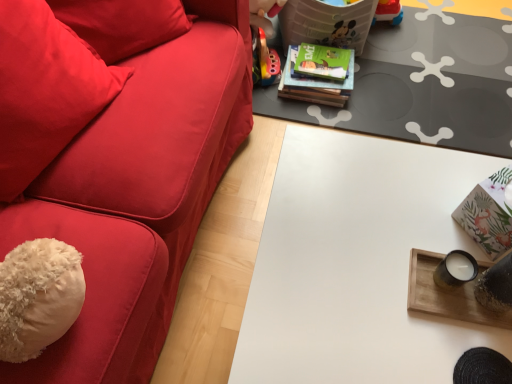
The image size is (512, 384). What do you see at coordinates (447, 294) in the screenshot?
I see `wooden tray at right, positioned as the 2th table in back-to-front order` at bounding box center [447, 294].

The width and height of the screenshot is (512, 384). What do you see at coordinates (45, 90) in the screenshot?
I see `velvety red throw pillow at left` at bounding box center [45, 90].

Where is `velvety red throw pillow at left`? The height and width of the screenshot is (384, 512). velvety red throw pillow at left is located at coordinates (45, 90).

This screenshot has height=384, width=512. What do you see at coordinates (314, 84) in the screenshot?
I see `green matte book at upper center` at bounding box center [314, 84].

At what (x,y) coordinates should I click in order to perform the action: click on matte gray table at center, the third table positioned from the bottom. Please return your answer as a coordinate pair (x, y). Looking at the image, I should click on (423, 85).

Measure the distance between matte gray table at center, the 1th table from the back, and camera.

A distance of 1.47 meters exists between matte gray table at center, the 1th table from the back, and camera.

Locate an element on the screen. This screenshot has width=512, height=384. wooden tray at right, the second table in the bottom-to-top sequence is located at coordinates (447, 294).

Is white matte table at center, the first table when ordered from front to back, touching green matte book at upper center?

No, white matte table at center, the first table when ordered from front to back, is not touching green matte book at upper center.

In terms of width, does white matte table at center, which ranks as the first table in bottom-to-top order, look wider or thinner when compared to green matte book at upper center?

Clearly, white matte table at center, which ranks as the first table in bottom-to-top order, has more width compared to green matte book at upper center.

Considering the relative sizes of white matte table at center, the 3th table when ordered from top to bottom, and green matte book at upper center in the image provided, is white matte table at center, the 3th table when ordered from top to bottom, bigger than green matte book at upper center?

Correct, white matte table at center, the 3th table when ordered from top to bottom, is larger in size than green matte book at upper center.

Do you think white matte table at center, which ranks as the first table in bottom-to-top order, is within green matte book at upper center, or outside of it?

white matte table at center, which ranks as the first table in bottom-to-top order, is located beyond the bounds of green matte book at upper center.

Is white matte table at center, the 3th table when ordered from top to bottom, looking in the opposite direction of velvety red throw pillow at left?

Yes, white matte table at center, the 3th table when ordered from top to bottom, is facing away from velvety red throw pillow at left.

Is white matte table at center, which ranks as the 3th table in back-to-front order, positioned far away from velvety red throw pillow at left?

Actually, white matte table at center, which ranks as the 3th table in back-to-front order, and velvety red throw pillow at left are a little close together.

From their relative heights in the image, would you say white matte table at center, which ranks as the 3th table in back-to-front order, is taller or shorter than velvety red throw pillow at left?

white matte table at center, which ranks as the 3th table in back-to-front order, is taller than velvety red throw pillow at left.

From a real-world perspective, is wooden tray at right, the second table when ordered from front to back, located beneath velvety red throw pillow at left?

Yes.

Is wooden tray at right, the second table in the bottom-to-top sequence, at the right side of velvety red throw pillow at left?

Yes.

From their relative heights in the image, would you say wooden tray at right, the second table when ordered from front to back, is taller or shorter than velvety red throw pillow at left?

In the image, wooden tray at right, the second table when ordered from front to back, appears to be shorter than velvety red throw pillow at left.

Is velvety red throw pillow at left spatially inside green matte book at upper center, or outside of it?

velvety red throw pillow at left is outside green matte book at upper center.

Between velvety red throw pillow at left and green matte book at upper center, which one has larger size?

With larger size is velvety red throw pillow at left.

Is point (50, 18) closer to camera compared to point (334, 89)?

That is True.

Is velvety red throw pillow at left taller or shorter than green matte book at upper center?

velvety red throw pillow at left is taller than green matte book at upper center.

Does wooden tray at right, marked as the 2th table in a top-to-bottom arrangement, appear on the right side of matte gray table at center, which appears as the first table when viewed from the top?

Incorrect, wooden tray at right, marked as the 2th table in a top-to-bottom arrangement, is not on the right side of matte gray table at center, which appears as the first table when viewed from the top.

Is matte gray table at center, which appears as the first table when viewed from the top, at the back of wooden tray at right, the second table in the bottom-to-top sequence?

wooden tray at right, the second table in the bottom-to-top sequence, does not have its back to matte gray table at center, which appears as the first table when viewed from the top.

Looking at this image, can you confirm if wooden tray at right, positioned as the 2th table in back-to-front order, is shorter than matte gray table at center, the 1th table from the back?

Correct, wooden tray at right, positioned as the 2th table in back-to-front order, is not as tall as matte gray table at center, the 1th table from the back.

Is wooden tray at right, marked as the 2th table in a top-to-bottom arrangement, not within matte gray table at center, the third table positioned from the bottom?

Yes, wooden tray at right, marked as the 2th table in a top-to-bottom arrangement, is not within matte gray table at center, the third table positioned from the bottom.

Is matte gray table at center, which appears as the first table when viewed from the top, outside of velvety red throw pillow at left?

Yes, matte gray table at center, which appears as the first table when viewed from the top, is located beyond the bounds of velvety red throw pillow at left.

Is matte gray table at center, the 1th table from the back, positioned behind velvety red throw pillow at left?

Yes, matte gray table at center, the 1th table from the back, is further from the camera.

Considering the relative sizes of matte gray table at center, which appears as the first table when viewed from the top, and velvety red throw pillow at left in the image provided, is matte gray table at center, which appears as the first table when viewed from the top, wider than velvety red throw pillow at left?

Yes, matte gray table at center, which appears as the first table when viewed from the top, is wider than velvety red throw pillow at left.

From a real-world perspective, is matte gray table at center, which appears as the first table when viewed from the top, positioned above or below velvety red throw pillow at left?

matte gray table at center, which appears as the first table when viewed from the top, is below velvety red throw pillow at left.

Is matte gray table at center, which appears as the first table when viewed from the top, located within velvety red throw pillow at left?

Definitely not — matte gray table at center, which appears as the first table when viewed from the top, is not inside velvety red throw pillow at left.

Which of these two, velvety red throw pillow at left or matte gray table at center, which appears as the first table when viewed from the top, is smaller?

Smaller between the two is matte gray table at center, which appears as the first table when viewed from the top.

Is velvety red throw pillow at left shorter than matte gray table at center, which is the 3th table from front to back?

Incorrect, the height of velvety red throw pillow at left does not fall short of that of matte gray table at center, which is the 3th table from front to back.

Is velvety red throw pillow at left aimed at matte gray table at center, which appears as the first table when viewed from the top?

No, velvety red throw pillow at left is not turned towards matte gray table at center, which appears as the first table when viewed from the top.

You are a GUI agent. You are given a task and a screenshot of the screen. Output one action in this format:
    pyautogui.click(x=<x>, y=<y>)
    Task: Click on the magazine lying on the left of white matte table at center, which ranks as the first table in bottom-to-top order
    This screenshot has width=512, height=384.
    Given the screenshot: What is the action you would take?
    pyautogui.click(x=314, y=84)

Find the location of a particular element. Image resolution: width=512 pixels, height=384 pixels. table that is the 1st object to the right of the velvety red throw pillow at left, starting at the anchor is located at coordinates (356, 263).

Looking at the image, which one is located further to green matte book at upper center, matte gray table at center, the third table positioned from the bottom, or white matte table at center, which ranks as the 3th table in back-to-front order?

white matte table at center, which ranks as the 3th table in back-to-front order, lies further to green matte book at upper center than the other object.

From the image, which object appears to be nearer to wooden tray at right, positioned as the 2th table in back-to-front order, velvety red throw pillow at left or white matte table at center, the 3th table when ordered from top to bottom?

white matte table at center, the 3th table when ordered from top to bottom, is closer to wooden tray at right, positioned as the 2th table in back-to-front order.

Looking at the image, which one is located further to green matte book at upper center, white matte table at center, the first table when ordered from front to back, or matte gray table at center, the third table positioned from the bottom?

white matte table at center, the first table when ordered from front to back, is positioned further to the anchor green matte book at upper center.

Which object lies further to the anchor point white matte table at center, which ranks as the 3th table in back-to-front order, green matte book at upper center or velvety red throw pillow at left?

green matte book at upper center.

When comparing their distances from green matte book at upper center, does white matte table at center, which ranks as the 3th table in back-to-front order, or wooden tray at right, the second table when ordered from front to back, seem further?

The object further to green matte book at upper center is wooden tray at right, the second table when ordered from front to back.

From the image, which object appears to be nearer to wooden tray at right, marked as the 2th table in a top-to-bottom arrangement, white matte table at center, the 3th table when ordered from top to bottom, or green matte book at upper center?

Among the two, white matte table at center, the 3th table when ordered from top to bottom, is located nearer to wooden tray at right, marked as the 2th table in a top-to-bottom arrangement.

Looking at the image, which one is located closer to velvety red throw pillow at left, green matte book at upper center or white matte table at center, the 3th table when ordered from top to bottom?

white matte table at center, the 3th table when ordered from top to bottom, is positioned closer to the anchor velvety red throw pillow at left.

From the image, which object appears to be farther from wooden tray at right, the second table when ordered from front to back, velvety red throw pillow at left or green matte book at upper center?

Based on the image, green matte book at upper center appears to be further to wooden tray at right, the second table when ordered from front to back.

At what (x,y) coordinates should I click in order to perform the action: click on table between white matte table at center, the 3th table when ordered from top to bottom, and matte gray table at center, the third table positioned from the bottom, along the z-axis. Please return your answer as a coordinate pair (x, y). Looking at the image, I should click on (447, 294).

The image size is (512, 384). I want to click on table positioned between wooden tray at right, positioned as the 2th table in back-to-front order, and green matte book at upper center from near to far, so click(x=423, y=85).

This screenshot has width=512, height=384. In order to click on table located between velvety red throw pillow at left and wooden tray at right, the second table in the bottom-to-top sequence, in the left-right direction in this screenshot , I will do tap(356, 263).

Find the location of `magazine between velvety red throw pillow at left and matte gray table at center, which appears as the first table when viewed from the top, from left to right`. magazine between velvety red throw pillow at left and matte gray table at center, which appears as the first table when viewed from the top, from left to right is located at coordinates (314, 84).